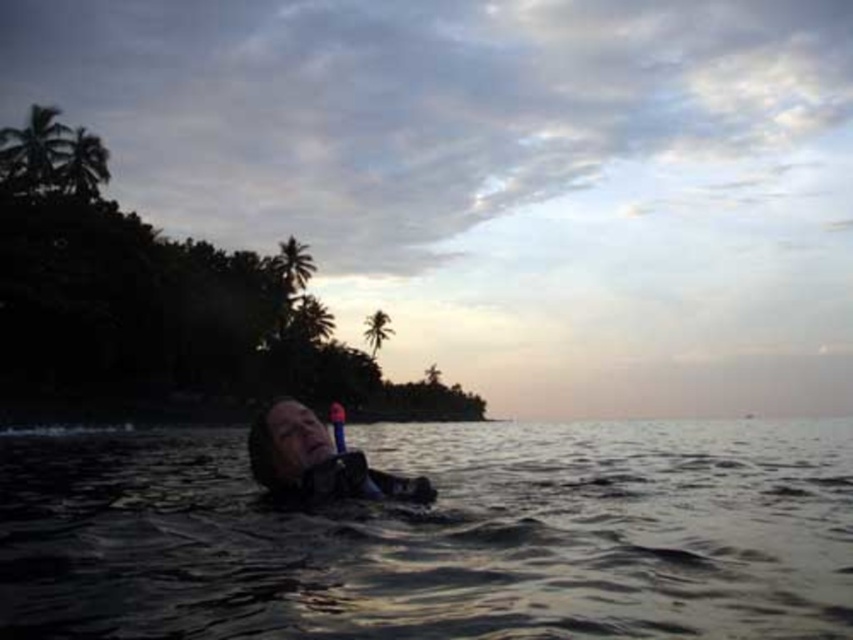
Which is below, dark matte water at center or matte black wetsuit at center?

dark matte water at center is below.

Between point (502, 625) and point (328, 484), which one is positioned in front?

Point (502, 625)

Image resolution: width=853 pixels, height=640 pixels. Identify the location of dark matte water at center. (437, 536).